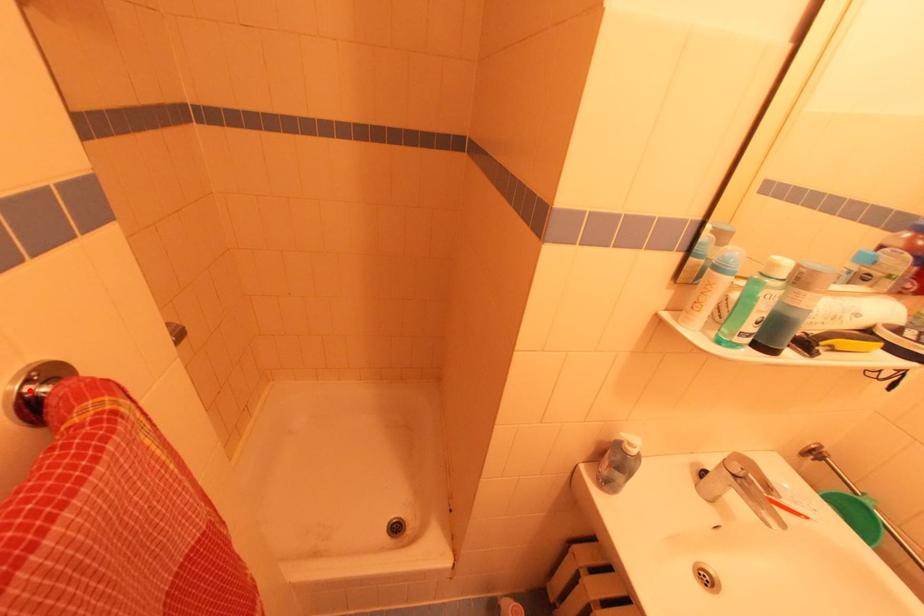
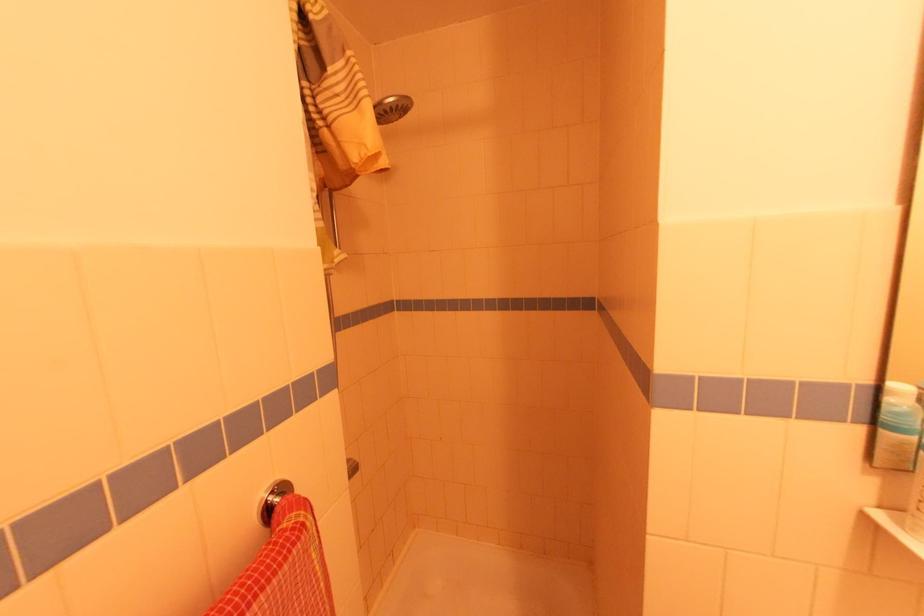
The point at the highlighted location is marked in the first image. Where is the corresponding point in the second image?

(272, 499)